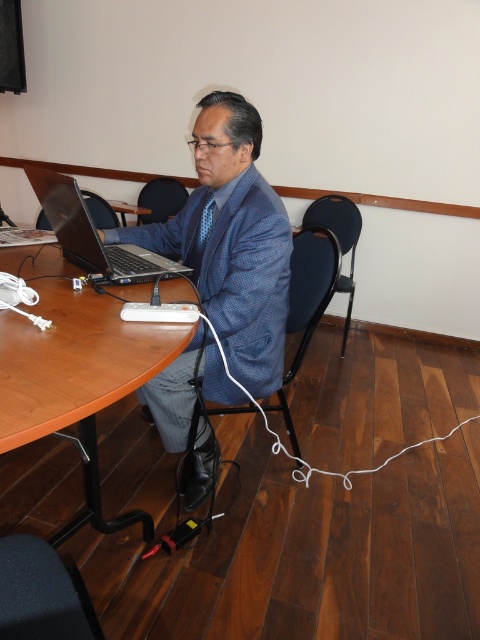
Is blue textured suit at center in front of matte black laptop at center?

No, it is behind matte black laptop at center.

In order to click on blue textured suit at center in this screenshot , I will do `click(231, 241)`.

Is point (192, 355) less distant than point (165, 257)?

Yes, it is in front of point (165, 257).

Locate an element on the screen. blue textured suit at center is located at coordinates (231, 241).

Can you confirm if brown wooden table at center is positioned above matte black laptop at center?

Incorrect, brown wooden table at center is not positioned above matte black laptop at center.

The width and height of the screenshot is (480, 640). I want to click on brown wooden table at center, so click(x=75, y=372).

Who is more forward, (x=57, y=257) or (x=80, y=220)?

Positioned in front is point (x=80, y=220).

I want to click on brown wooden table at center, so click(75, 372).

Is point (203, 102) positioned in front of point (86, 403)?

No, it is not.

Between point (239, 250) and point (84, 400), which one is positioned in front?

Positioned in front is point (84, 400).

Image resolution: width=480 pixels, height=640 pixels. I want to click on blue textured suit at center, so click(x=231, y=241).